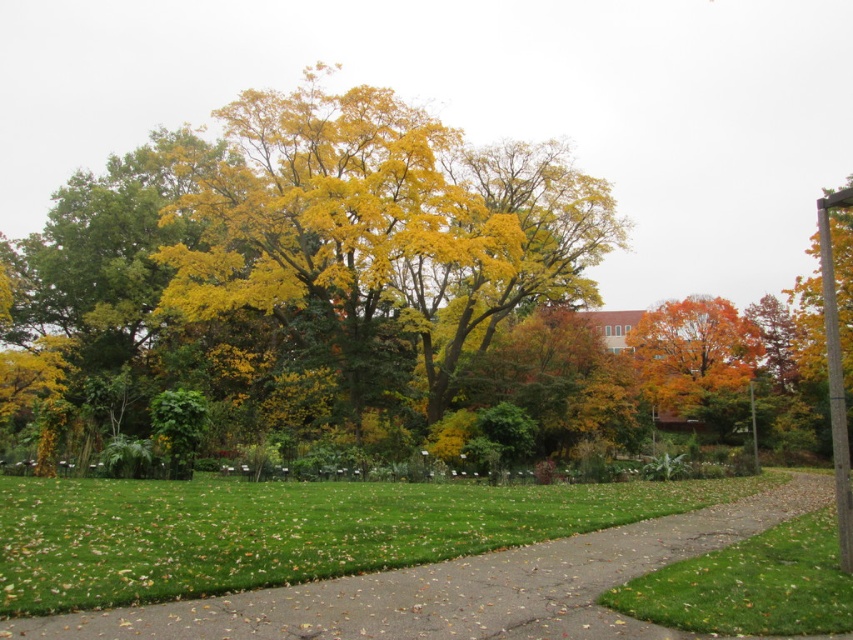
Is green grass at lower right thinner than orange autumn leaves at center?

Indeed, green grass at lower right has a lesser width compared to orange autumn leaves at center.

Image resolution: width=853 pixels, height=640 pixels. Find the location of `green grass at lower right`. green grass at lower right is located at coordinates (750, 586).

Identify the location of green grass at lower right. (750, 586).

Who is higher up, yellow-green foliage at center or green concrete pavement at center?

yellow-green foliage at center

From the picture: Does yellow-green foliage at center appear on the right side of green concrete pavement at center?

Incorrect, yellow-green foliage at center is not on the right side of green concrete pavement at center.

Is point (430, 122) less distant than point (488, 600)?

No, (430, 122) is further to viewer.

The width and height of the screenshot is (853, 640). What are the coordinates of `yellow-green foliage at center` in the screenshot? It's located at (341, 304).

Which is below, yellow-green foliage at center or orange autumn leaves at center?

Positioned lower is orange autumn leaves at center.

Is yellow-green foliage at center to the left of orange autumn leaves at center from the viewer's perspective?

Indeed, yellow-green foliage at center is positioned on the left side of orange autumn leaves at center.

Identify the location of yellow-green foliage at center. The width and height of the screenshot is (853, 640). (341, 304).